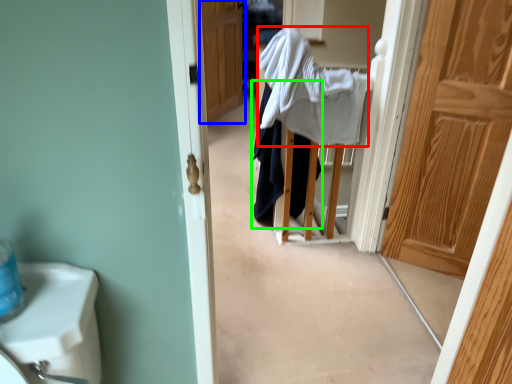
Question: Considering the real-world distances, which object is farthest from bath towel (highlighted by a red box)? door (highlighted by a blue box) or clothing (highlighted by a green box)?

Choices:
 (A) door
 (B) clothing

Answer: (A)